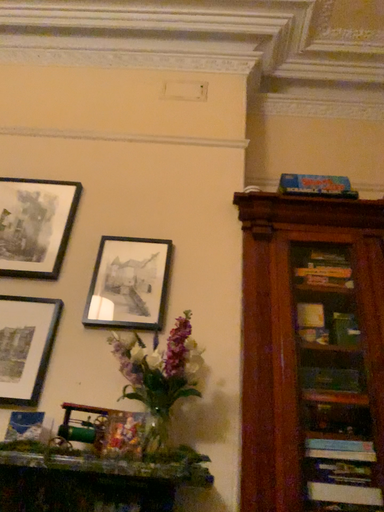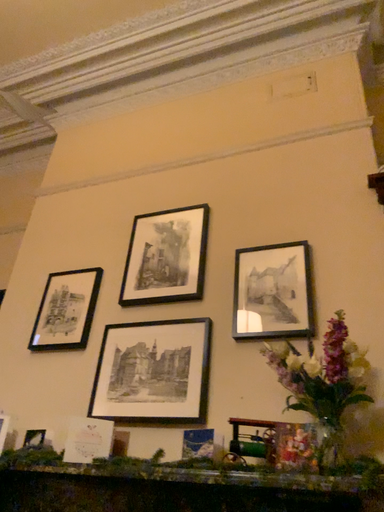
Question: How did the camera likely rotate when shooting the video?

Choices:
 (A) rotated right
 (B) rotated left

Answer: (B)